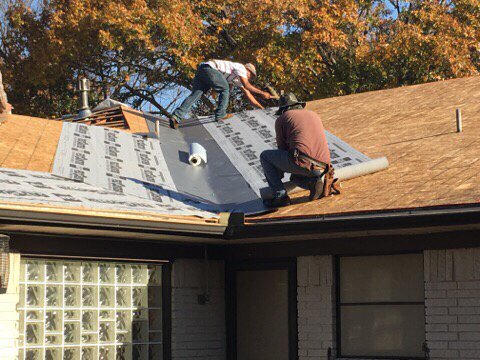
Where is `light fixture`? light fixture is located at coordinates (206, 298).